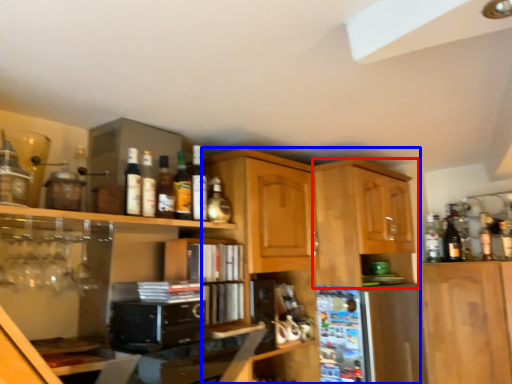
Question: Which point is closer to the camera, cabinetry (highlighted by a red box) or cabinetry (highlighted by a blue box)?

Choices:
 (A) cabinetry
 (B) cabinetry

Answer: (B)